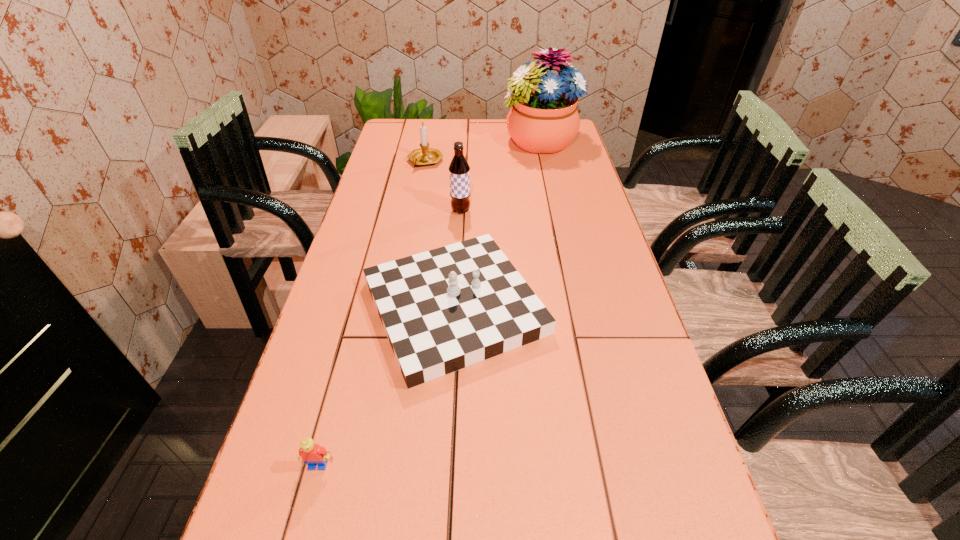
Where is `vacant space positioned 0.070m on the left of the third tallest object`? Image resolution: width=960 pixels, height=540 pixels. vacant space positioned 0.070m on the left of the third tallest object is located at coordinates (389, 161).

Identify the location of free space located 0.100m on the back of the fourth farthest object. (459, 227).

You are a GUI agent. You are given a task and a screenshot of the screen. Output one action in this format:
    pyautogui.click(x=<x>, y=<y>)
    Task: Click on the vacant region located on the face of the Lego
    This screenshot has height=540, width=960.
    Given the screenshot: What is the action you would take?
    pyautogui.click(x=307, y=505)

I want to click on object present at the far edge, so click(x=543, y=119).

You are a GUI agent. You are given a task and a screenshot of the screen. Output one action in this format:
    pyautogui.click(x=<x>, y=<y>)
    Task: Click on the candle holder that is at the left edge
    This screenshot has height=540, width=960.
    Given the screenshot: What is the action you would take?
    pyautogui.click(x=424, y=156)

This screenshot has width=960, height=540. What are the coordinates of `checkerboard at the left edge` in the screenshot? It's located at (445, 309).

I want to click on Lego positioned at the left edge, so click(313, 455).

What are the coordinates of `object located at the right edge` in the screenshot? It's located at (543, 119).

Locate an element on the screen. Image resolution: width=960 pixels, height=540 pixels. object located at the far right corner is located at coordinates (543, 119).

The image size is (960, 540). In the image, there is a desktop. Identify the location of vacant space at the far edge. (497, 119).